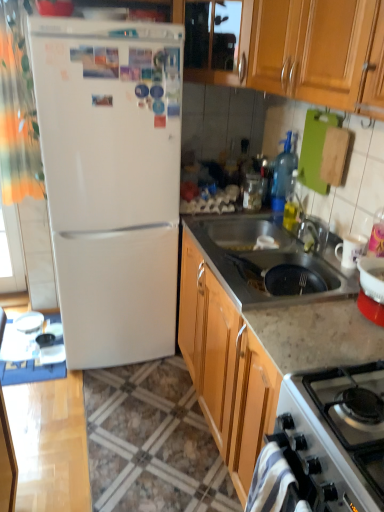
Question: Is the depth of stainless steel sink at lower center greater than that of white glossy refrigerator at left?

Choices:
 (A) no
 (B) yes

Answer: (A)

Question: Does stainless steel sink at lower center have a greater height compared to white glossy refrigerator at left?

Choices:
 (A) no
 (B) yes

Answer: (A)

Question: Can you confirm if stainless steel sink at lower center is smaller than white glossy refrigerator at left?

Choices:
 (A) yes
 (B) no

Answer: (A)

Question: Considering the relative positions of stainless steel sink at lower center and white glossy refrigerator at left in the image provided, is stainless steel sink at lower center to the right of white glossy refrigerator at left from the viewer's perspective?

Choices:
 (A) no
 (B) yes

Answer: (B)

Question: Is the surface of stainless steel sink at lower center in direct contact with white glossy refrigerator at left?

Choices:
 (A) yes
 (B) no

Answer: (B)

Question: Is stainless steel sink at lower center to the left of white glossy refrigerator at left from the viewer's perspective?

Choices:
 (A) no
 (B) yes

Answer: (A)

Question: From a real-world perspective, is stainless steel sink at lower center on top of orange fabric curtain at left?

Choices:
 (A) yes
 (B) no

Answer: (B)

Question: Would you say stainless steel sink at lower center is a long distance from orange fabric curtain at left?

Choices:
 (A) no
 (B) yes

Answer: (B)

Question: Is stainless steel sink at lower center closer to the viewer compared to orange fabric curtain at left?

Choices:
 (A) no
 (B) yes

Answer: (B)

Question: Does stainless steel sink at lower center have a lesser height compared to orange fabric curtain at left?

Choices:
 (A) yes
 (B) no

Answer: (A)

Question: Can you see stainless steel sink at lower center touching orange fabric curtain at left?

Choices:
 (A) yes
 (B) no

Answer: (B)

Question: Is stainless steel sink at lower center smaller than orange fabric curtain at left?

Choices:
 (A) yes
 (B) no

Answer: (B)

Question: Are white glossy refrigerator at left and white glossy gas stove at lower right beside each other?

Choices:
 (A) no
 (B) yes

Answer: (A)